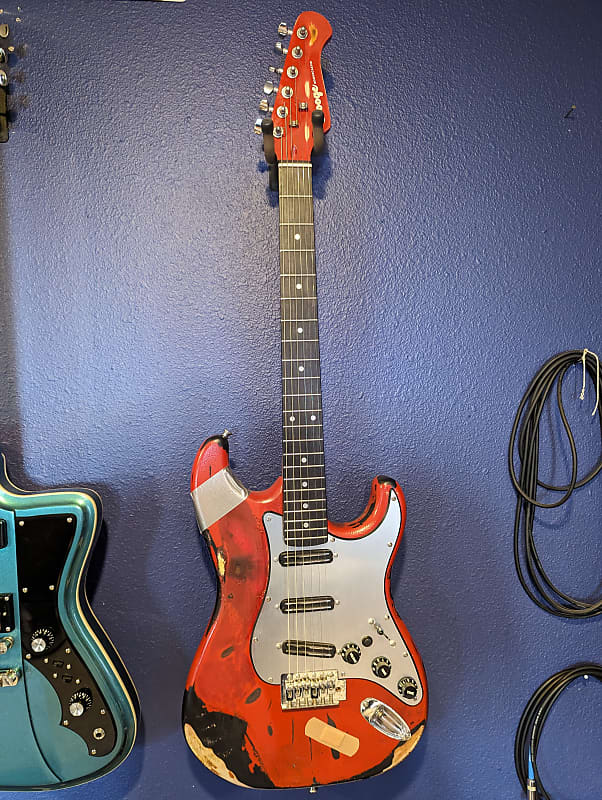
The width and height of the screenshot is (602, 800). What are the coordinates of `dark blue wall` in the screenshot? It's located at (477, 678).